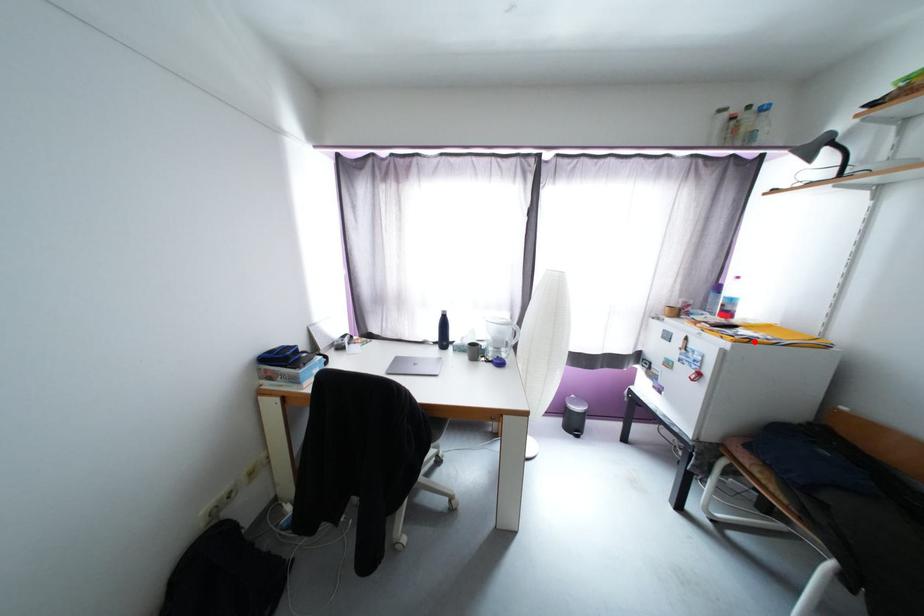
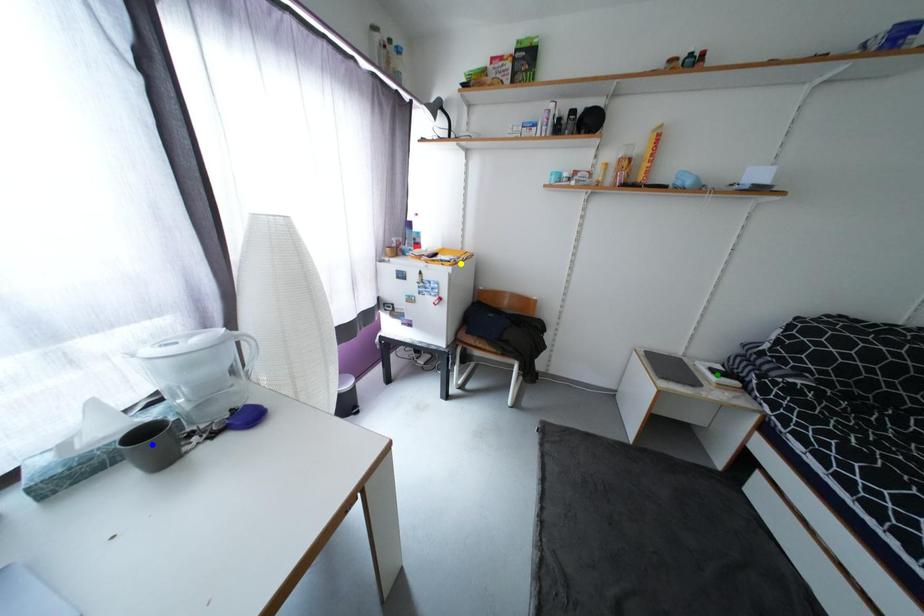
Question: I am providing you with two images of the same scene from different viewpoints. A red point is marked on the first image. You are given multiple points on the second image. Which mark in image 2 goes with the point in image 1?

Choices:
 (A) blue point
 (B) yellow point
 (C) green point

Answer: (B)